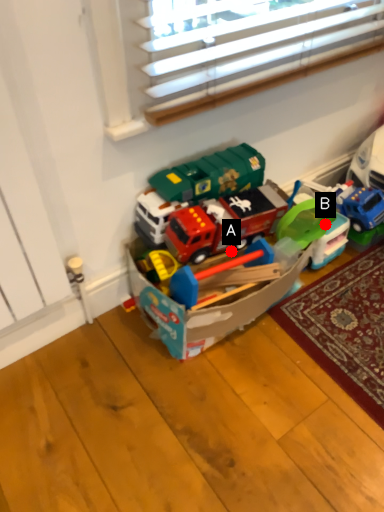
Question: Two points are circled on the image, labeled by A and B beside each circle. Which of the following is the farthest from the observer?

Choices:
 (A) A is further
 (B) B is further

Answer: (B)